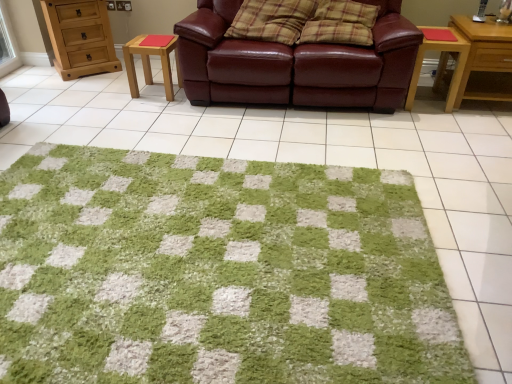
Identify the location of free location to the left of wooden stool at center-left, the first table positioned from the left. (115, 92).